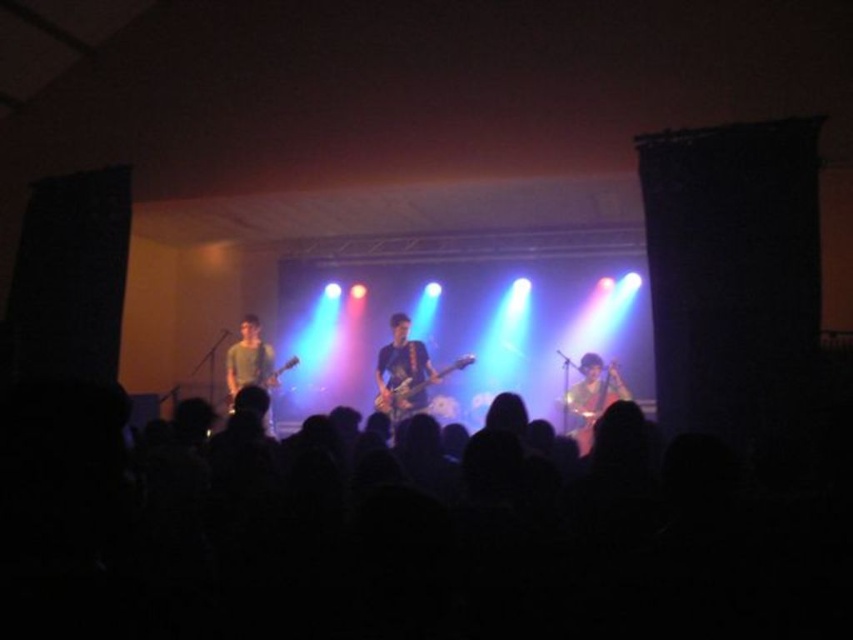
Question: Can you confirm if shiny black guitar at center is wider than matte black guitar at left?

Choices:
 (A) no
 (B) yes

Answer: (B)

Question: Considering the real-world distances, which object is farthest from the green matte shirt at center?

Choices:
 (A) shiny brown guitar at center
 (B) shiny metallic guitar at center
 (C) matte black guitar at left
 (D) shiny black guitar at center

Answer: (A)

Question: Where is shiny black guitar at center located in relation to shiny metallic guitar at center in the image?

Choices:
 (A) below
 (B) above

Answer: (B)

Question: Which point appears farthest from the camera in this image?

Choices:
 (A) (233, 401)
 (B) (231, 385)
 (C) (323, 588)

Answer: (B)

Question: Among these objects, which one is nearest to the camera?

Choices:
 (A) shiny black guitar at center
 (B) shiny brown guitar at center
 (C) matte black guitar at left
 (D) black matte crowd at lower center

Answer: (D)

Question: In this image, where is black matte crowd at lower center located relative to shiny brown guitar at center?

Choices:
 (A) left
 (B) right

Answer: (A)